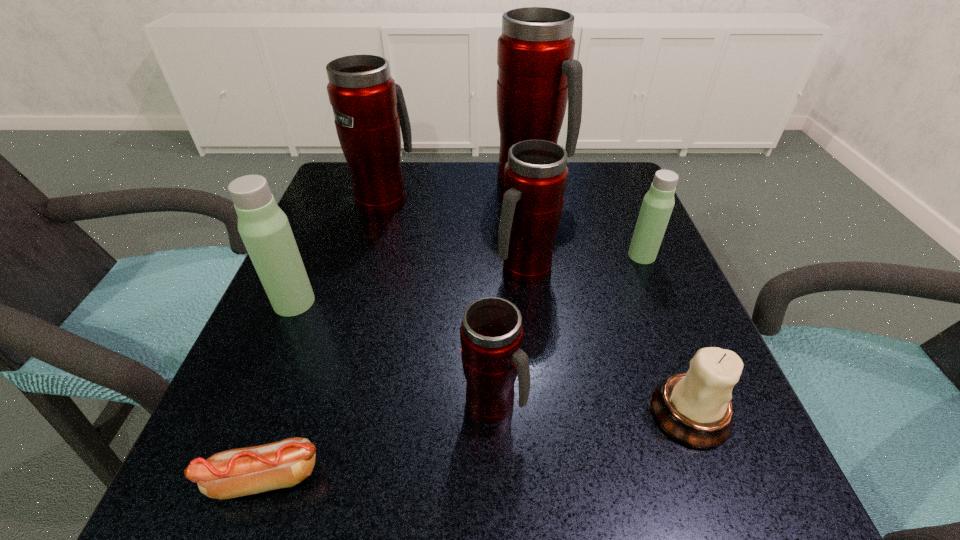
Where is `the smallest red thermos bottle`? The width and height of the screenshot is (960, 540). the smallest red thermos bottle is located at coordinates (491, 334).

I want to click on candle holder, so click(694, 408).

At what (x,y) coordinates should I click in order to perform the action: click on white candle holder. Please return your answer as a coordinate pair (x, y). Looking at the image, I should click on (694, 408).

At what (x,y) coordinates should I click in order to perform the action: click on the shortest object. Please return your answer as a coordinate pair (x, y). The width and height of the screenshot is (960, 540). Looking at the image, I should click on pyautogui.click(x=239, y=472).

You are a GUI agent. You are given a task and a screenshot of the screen. Output one action in this format:
    pyautogui.click(x=<x>, y=<y>)
    Task: Click on the brown sausage
    
    Given the screenshot: What is the action you would take?
    pyautogui.click(x=239, y=472)

Find the location of `free point located on the side with the handle of the tallest object`. free point located on the side with the handle of the tallest object is located at coordinates (623, 181).

Where is `free spot located 0.080m on the side with the handle of the second tallest object`? The height and width of the screenshot is (540, 960). free spot located 0.080m on the side with the handle of the second tallest object is located at coordinates (394, 166).

Where is `vacant space located 0.180m on the side with the handle of the second nearest red thermos bottle`? vacant space located 0.180m on the side with the handle of the second nearest red thermos bottle is located at coordinates (537, 375).

This screenshot has width=960, height=540. Identify the location of vacant space situated on the front of the nearer light thermos bottle. (239, 433).

Identify the location of vacant space located 0.160m on the left of the smaller light thermos bottle. (547, 255).